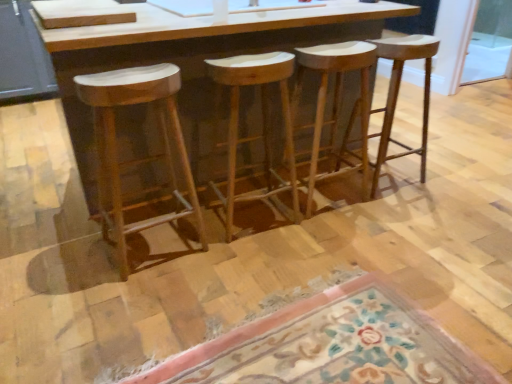
This screenshot has height=384, width=512. Identify the location of vacant point to the right of natural wood stool at center, which appears as the second stool when viewed from the left. (323, 232).